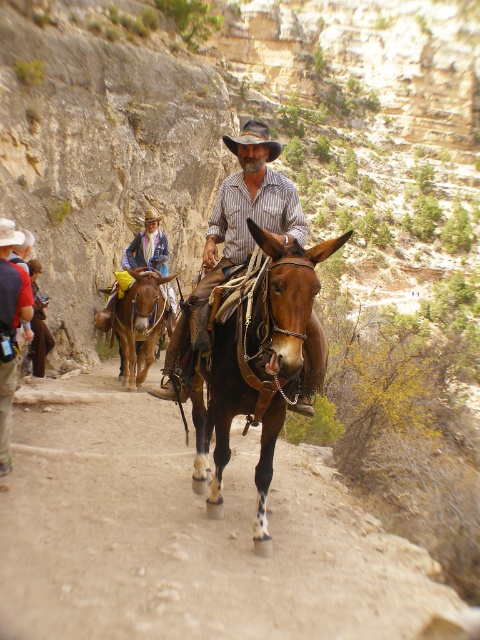
Question: Is brown leather donkey at center positioned before rustic leather cowboy hat at center?

Choices:
 (A) no
 (B) yes

Answer: (B)

Question: Is reddish-brown leather jacket at lower left positioned at the back of brown leather cowboy hat at center?

Choices:
 (A) yes
 (B) no

Answer: (A)

Question: Is brown leather donkey at center positioned at the back of brown leather mule at center?

Choices:
 (A) yes
 (B) no

Answer: (B)

Question: Which of the following is the closest to the observer?

Choices:
 (A) (144, 284)
 (B) (264, 136)

Answer: (B)

Question: Among these points, which one is nearest to the camera?

Choices:
 (A) (252, 132)
 (B) (46, 305)
 (C) (264, 289)

Answer: (C)

Question: Which point appears closest to the camera in this image?

Choices:
 (A) (247, 128)
 (B) (48, 301)
 (C) (134, 353)
 (D) (242, 141)

Answer: (D)